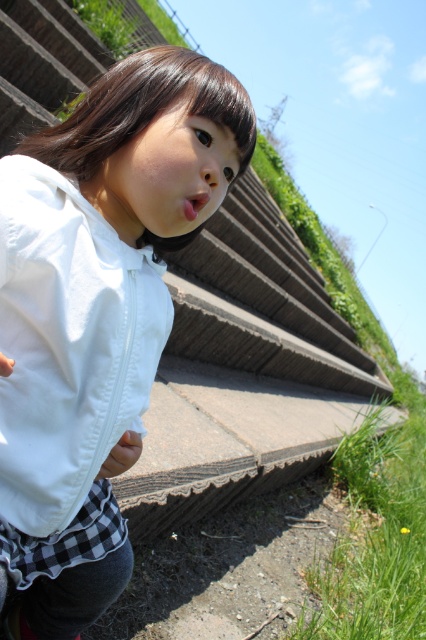
You are a photographer trying to capture the girl in the scene. You notice two white matte jackets in the image. Which jacket is closer to the camera, the white matte jacket at center or the white matte jacket at lower left?

The white matte jacket at center is positioned under the white matte jacket at lower left, meaning the white matte jacket at lower left is closer to the camera.